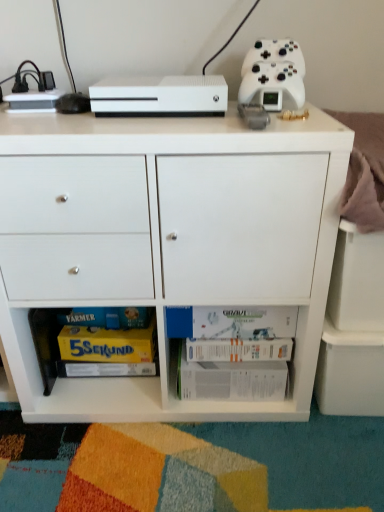
What are the coordinates of `empty space that is to the right of white paper book at lower center, the 2th book in the top-to-bottom sequence` in the screenshot? It's located at (316, 426).